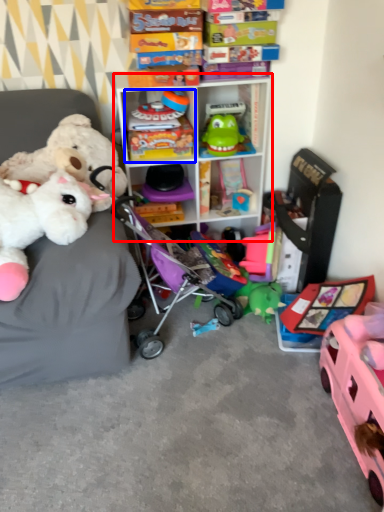
Question: Among these objects, which one is nearest to the camera, shelf (highlighted by a red box) or toy (highlighted by a blue box)?

Choices:
 (A) shelf
 (B) toy

Answer: (A)